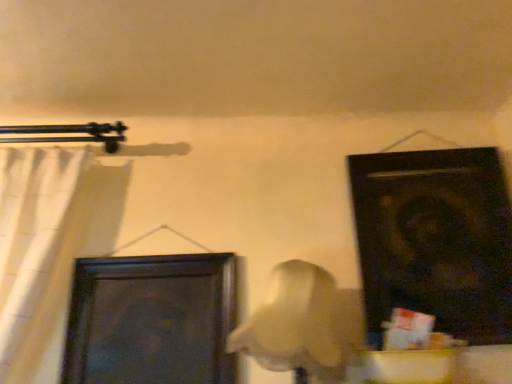
Describe the element at coordinates (151, 320) in the screenshot. The image size is (512, 384). I see `dark wood door at center-left, which is the second door from right to left` at that location.

Describe the element at coordinates (435, 240) in the screenshot. This screenshot has height=384, width=512. I see `black matte door at upper right, the 1th door positioned from the right` at that location.

The height and width of the screenshot is (384, 512). I want to click on dark wood door at center-left, which is the second door from right to left, so click(x=151, y=320).

Consider the image. Which of these two, dark wood door at center-left, which is the second door from right to left, or white fabric curtain at left, is smaller?

With smaller size is dark wood door at center-left, which is the second door from right to left.

Which is in front, dark wood door at center-left, which is the second door from right to left, or white fabric curtain at left?

white fabric curtain at left is in front.

Considering the relative sizes of dark wood door at center-left, which is the second door from right to left, and white fabric curtain at left in the image provided, is dark wood door at center-left, which is the second door from right to left, thinner than white fabric curtain at left?

Indeed, dark wood door at center-left, which is the second door from right to left, has a lesser width compared to white fabric curtain at left.

Relative to white fabric curtain at left, is black matte door at upper right, the 1th door positioned from the right, in front or behind?

black matte door at upper right, the 1th door positioned from the right, is behind white fabric curtain at left.

How different are the orientations of black matte door at upper right, the 1th door positioned from the right, and white fabric curtain at left in degrees?

The facing directions of black matte door at upper right, the 1th door positioned from the right, and white fabric curtain at left are 2.62 degrees apart.

Is black matte door at upper right, the 1th door positioned from the right, to the right of white fabric curtain at left from the viewer's perspective?

Correct, you'll find black matte door at upper right, the 1th door positioned from the right, to the right of white fabric curtain at left.

Measure the distance from black matte door at upper right, the 1th door positioned from the right, to white fabric curtain at left.

The distance of black matte door at upper right, the 1th door positioned from the right, from white fabric curtain at left is 3.66 feet.

Looking at this image, which of these two, white fabric curtain at left or black matte door at upper right, the 1th door positioned from the right, is thinner?

black matte door at upper right, the 1th door positioned from the right, is thinner.

Looking at this image, could you tell me if white fabric curtain at left is facing black matte door at upper right, the 1th door positioned from the right?

No, white fabric curtain at left is not turned towards black matte door at upper right, the 1th door positioned from the right.

Considering the sizes of objects white fabric curtain at left and black matte door at upper right, acting as the 2th door starting from the left, in the image provided, who is shorter, white fabric curtain at left or black matte door at upper right, acting as the 2th door starting from the left,?

white fabric curtain at left is shorter.

Is white fabric curtain at left touching black matte door at upper right, acting as the 2th door starting from the left?

No, white fabric curtain at left is not in contact with black matte door at upper right, acting as the 2th door starting from the left.

From the picture: Choose the correct answer: Is black matte door at upper right, the 1th door positioned from the right, inside dark wood door at center-left, which is the second door from right to left, or outside it?

black matte door at upper right, the 1th door positioned from the right, exists outside the volume of dark wood door at center-left, which is the second door from right to left.

From a real-world perspective, is black matte door at upper right, acting as the 2th door starting from the left, positioned over dark wood door at center-left, which is the second door from right to left, based on gravity?

Yes.

Who is shorter, black matte door at upper right, acting as the 2th door starting from the left, or dark wood door at center-left, which is the second door from right to left?

Standing shorter between the two is dark wood door at center-left, which is the second door from right to left.

Measure the distance from white fabric curtain at left to dark wood door at center-left, which is the second door from right to left.

A distance of 12.11 inches exists between white fabric curtain at left and dark wood door at center-left, which is the second door from right to left.

In the scene shown: Between white fabric curtain at left and dark wood door at center-left, which is the second door from right to left, which one has less height?

Standing shorter between the two is dark wood door at center-left, which is the second door from right to left.

Which object is wider, white fabric curtain at left or dark wood door at center-left, which is the second door from right to left?

white fabric curtain at left.

Is there a large distance between white fabric curtain at left and dark wood door at center-left, which is the second door from right to left?

They are positioned close to each other.

Is dark wood door at center-left, which is the second door from right to left, at the right side of black matte door at upper right, acting as the 2th door starting from the left?

No.

Considering the relative sizes of dark wood door at center-left, which is the second door from right to left, and black matte door at upper right, the 1th door positioned from the right, in the image provided, is dark wood door at center-left, which is the second door from right to left, smaller than black matte door at upper right, the 1th door positioned from the right,?

Correct, dark wood door at center-left, which is the second door from right to left, occupies less space than black matte door at upper right, the 1th door positioned from the right.

Identify the location of door on the left of black matte door at upper right, the 1th door positioned from the right. This screenshot has width=512, height=384. (151, 320).

Are dark wood door at center-left, which is the second door from right to left, and black matte door at upper right, the 1th door positioned from the right, beside each other?

They are not placed beside each other.

Where is `curtain above the dark wood door at center-left, the first door viewed from the left (from the image's perspective)`? This screenshot has height=384, width=512. curtain above the dark wood door at center-left, the first door viewed from the left (from the image's perspective) is located at coordinates (31, 233).

Image resolution: width=512 pixels, height=384 pixels. In order to click on door that is above the white fabric curtain at left (from a real-world perspective) in this screenshot , I will do `click(435, 240)`.

In the scene shown: From the image, which object appears to be nearer to dark wood door at center-left, which is the second door from right to left, white fabric curtain at left or black matte door at upper right, the 1th door positioned from the right?

Answer: white fabric curtain at left is closer to dark wood door at center-left, which is the second door from right to left.

From the image, which object appears to be farther from white fabric curtain at left, black matte door at upper right, acting as the 2th door starting from the left, or dark wood door at center-left, which is the second door from right to left?

The object further to white fabric curtain at left is black matte door at upper right, acting as the 2th door starting from the left.

Estimate the real-world distances between objects in this image. Which object is closer to black matte door at upper right, the 1th door positioned from the right, white fabric curtain at left or dark wood door at center-left, the first door viewed from the left?

Based on the image, dark wood door at center-left, the first door viewed from the left, appears to be nearer to black matte door at upper right, the 1th door positioned from the right.

Estimate the real-world distances between objects in this image. Which object is closer to white fabric curtain at left, dark wood door at center-left, the first door viewed from the left, or black matte door at upper right, the 1th door positioned from the right?

Based on the image, dark wood door at center-left, the first door viewed from the left, appears to be nearer to white fabric curtain at left.

Looking at the image, which one is located further to black matte door at upper right, acting as the 2th door starting from the left, dark wood door at center-left, the first door viewed from the left, or white fabric curtain at left?

white fabric curtain at left lies further to black matte door at upper right, acting as the 2th door starting from the left, than the other object.

Which object lies further to the anchor point dark wood door at center-left, which is the second door from right to left, black matte door at upper right, the 1th door positioned from the right, or white fabric curtain at left?

black matte door at upper right, the 1th door positioned from the right, lies further to dark wood door at center-left, which is the second door from right to left, than the other object.

I want to click on door between white fabric curtain at left and black matte door at upper right, the 1th door positioned from the right, in the horizontal direction, so click(151, 320).